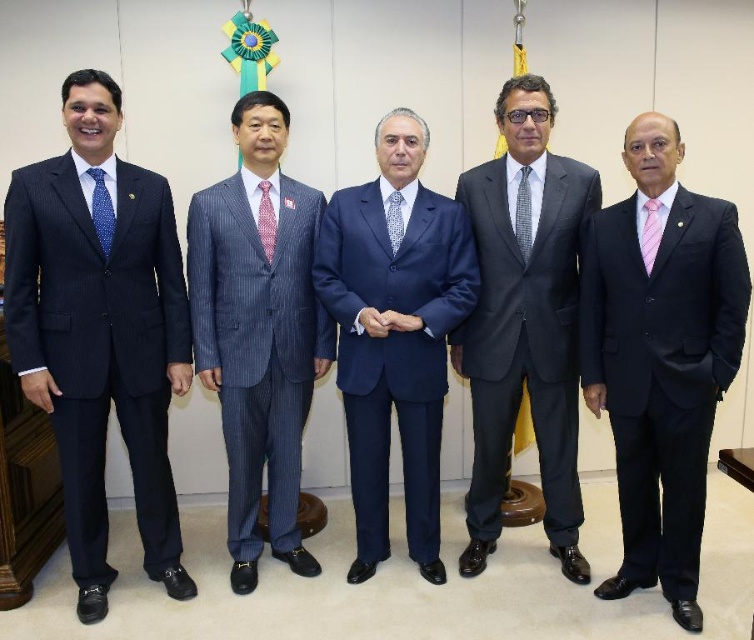
Question: Which point is closer to the camera?

Choices:
 (A) (377, 428)
 (B) (690, 448)
 (C) (256, 349)

Answer: (B)

Question: Does pink silk suit at right appear over gray checkered tie at center?

Choices:
 (A) no
 (B) yes

Answer: (A)

Question: From the image, what is the correct spatial relationship of blue satin suit at center in relation to pink patterned tie at center?

Choices:
 (A) left
 (B) right

Answer: (B)

Question: Is pink silk suit at right bigger than blue dotted tie at left?

Choices:
 (A) yes
 (B) no

Answer: (A)

Question: Considering the real-world distances, which object is farthest from the pink silk tie at right?

Choices:
 (A) gray checkered tie at center
 (B) pink patterned tie at center
 (C) dark gray suit at center

Answer: (B)

Question: Among these points, which one is nearest to the camera?

Choices:
 (A) (379, 449)
 (B) (523, 252)
 (C) (550, 205)
 (D) (166, 586)

Answer: (B)